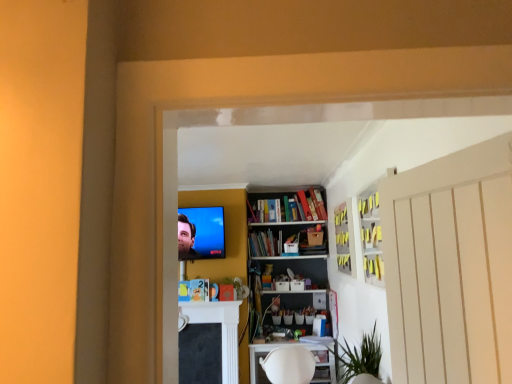
Question: From the image's perspective, is green matte plant at center on matte yellow book at center, marked as the 1th book in a left-to-right arrangement?

Choices:
 (A) no
 (B) yes

Answer: (B)

Question: Considering the relative sizes of green matte plant at center and matte yellow book at center, marked as the 1th book in a left-to-right arrangement, in the image provided, is green matte plant at center bigger than matte yellow book at center, marked as the 1th book in a left-to-right arrangement,?

Choices:
 (A) yes
 (B) no

Answer: (A)

Question: Can you confirm if green matte plant at center is positioned to the right of matte yellow book at center, marked as the 1th book in a left-to-right arrangement?

Choices:
 (A) no
 (B) yes

Answer: (B)

Question: Considering the relative sizes of green matte plant at center and matte yellow book at center, marked as the 1th book in a left-to-right arrangement, in the image provided, is green matte plant at center wider than matte yellow book at center, marked as the 1th book in a left-to-right arrangement,?

Choices:
 (A) no
 (B) yes

Answer: (B)

Question: Is matte yellow book at center, marked as the 1th book in a left-to-right arrangement, completely or partially inside green matte plant at center?

Choices:
 (A) no
 (B) yes

Answer: (A)

Question: Is point [225, 283] positioned closer to the camera than point [203, 283]?

Choices:
 (A) closer
 (B) farther

Answer: (B)

Question: From a real-world perspective, is green matte plant at center positioned above or below matte yellow book at center, marked as the 1th book in a left-to-right arrangement?

Choices:
 (A) below
 (B) above

Answer: (A)

Question: From their relative heights in the image, would you say green matte plant at center is taller or shorter than matte yellow book at center, acting as the first book starting from the front?

Choices:
 (A) short
 (B) tall

Answer: (A)

Question: Considering their positions, is green matte plant at center located in front of or behind matte yellow book at center, acting as the first book starting from the front?

Choices:
 (A) front
 (B) behind

Answer: (A)

Question: Considering the positions of point (367, 223) and point (239, 292), is point (367, 223) closer or farther from the camera than point (239, 292)?

Choices:
 (A) farther
 (B) closer

Answer: (B)

Question: Relative to green matte plant at center, is white glossy cabinet at upper right, the first cabinet in the front-to-back sequence, in front or behind?

Choices:
 (A) front
 (B) behind

Answer: (A)

Question: Is white glossy cabinet at upper right, the first cabinet in the front-to-back sequence, spatially inside green matte plant at center, or outside of it?

Choices:
 (A) inside
 (B) outside

Answer: (B)

Question: From the image's perspective, is white glossy cabinet at upper right, the first cabinet in the front-to-back sequence, above or below green matte plant at center?

Choices:
 (A) below
 (B) above

Answer: (B)

Question: From the image's perspective, is white glossy cabinet at upper right, the first cabinet in the front-to-back sequence, above or below matte black tv at upper center?

Choices:
 (A) above
 (B) below

Answer: (A)

Question: Considering the positions of point (378, 261) and point (220, 235), is point (378, 261) closer or farther from the camera than point (220, 235)?

Choices:
 (A) closer
 (B) farther

Answer: (A)